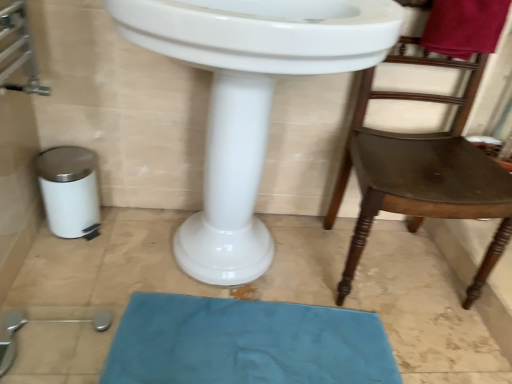
At what (x,y) coordinates should I click in order to perform the action: click on vacant area on top of blue fabric bath mat at lower center (from a real-world perspective). Please return your answer as a coordinate pair (x, y). The width and height of the screenshot is (512, 384). Looking at the image, I should click on (252, 347).